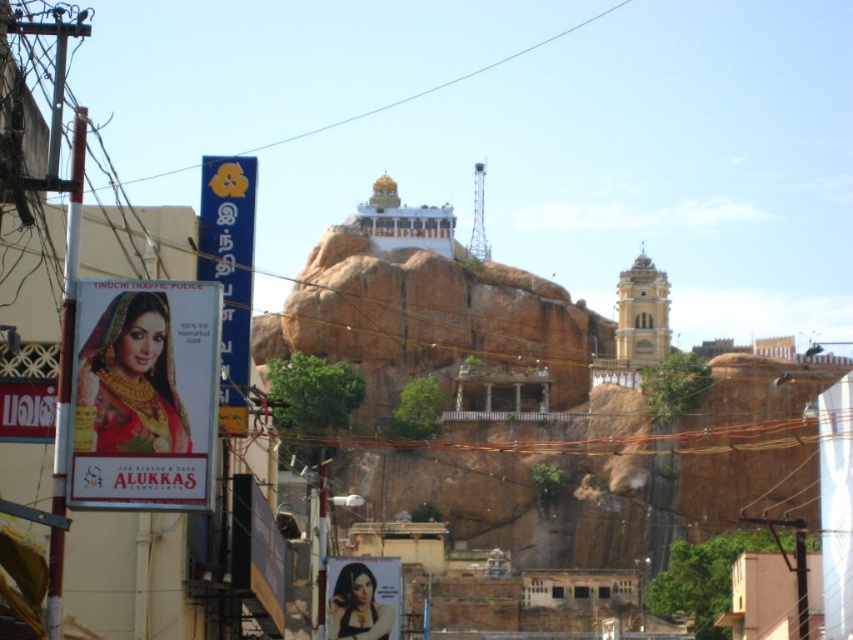
You are a tourist standing in the urban scene and want to locate the matte gold billboard at left and the blue plastic sign at left. According to their positions, which one is positioned more to the left side?

The matte gold billboard at left is positioned to the left of the blue plastic sign at left, so the matte gold billboard at left is more to the left side.

You are a city planner assessing the visual impact of billboards. You notice the matte gold billboard at left and the blue plastic sign at left are both on the same street corner. Which one has a narrower width?

The matte gold billboard at left is thinner than the blue plastic sign at left, so the matte gold billboard at left has a narrower width.

You are a delivery person with a 3.5 meter long package. You need to navigate through the space between the matte gold billboard at left and the blue plastic sign at left. Can your package fit through this space without bending?

The distance between the matte gold billboard at left and the blue plastic sign at left is 4.29 meters, which is wider than the 3.5 meter long package. Therefore, the package can fit through the space without bending.